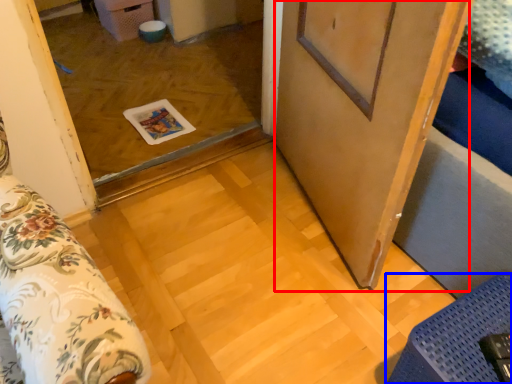
Question: Which object is further to the camera taking this photo, barn door (highlighted by a red box) or furniture (highlighted by a blue box)?

Choices:
 (A) barn door
 (B) furniture

Answer: (B)